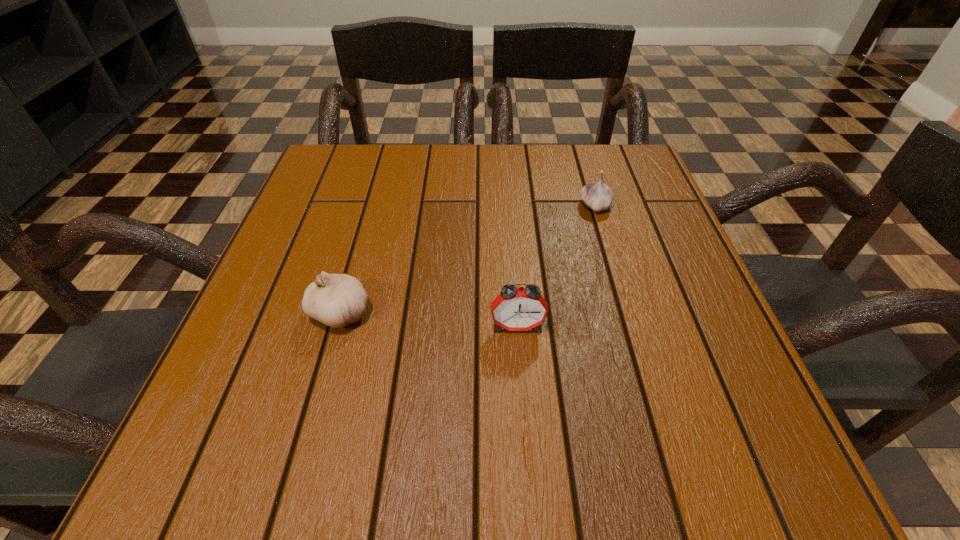
Where is `object located at the right edge`? This screenshot has height=540, width=960. object located at the right edge is located at coordinates (598, 196).

Where is `object positioned at the far right corner`? The height and width of the screenshot is (540, 960). object positioned at the far right corner is located at coordinates (598, 196).

At what (x,y) coordinates should I click in order to perform the action: click on free space at the far edge of the desktop. Please return your answer as a coordinate pair (x, y). The height and width of the screenshot is (540, 960). Looking at the image, I should click on (421, 168).

I want to click on free space at the near edge of the desktop, so click(409, 461).

The height and width of the screenshot is (540, 960). Find the location of `blank space at the left edge of the desktop`. blank space at the left edge of the desktop is located at coordinates (247, 310).

Image resolution: width=960 pixels, height=540 pixels. I want to click on vacant space at the right edge of the desktop, so click(x=679, y=380).

The image size is (960, 540). Identify the location of free spot at the far left corner of the desktop. (x=363, y=175).

Identify the location of free location at the near right corner of the desktop. (670, 427).

In order to click on free spot between the left garlic and the second object from right to left in this screenshot , I will do `click(429, 319)`.

This screenshot has width=960, height=540. Identify the location of free space between the nearer garlic and the rightmost object. (468, 259).